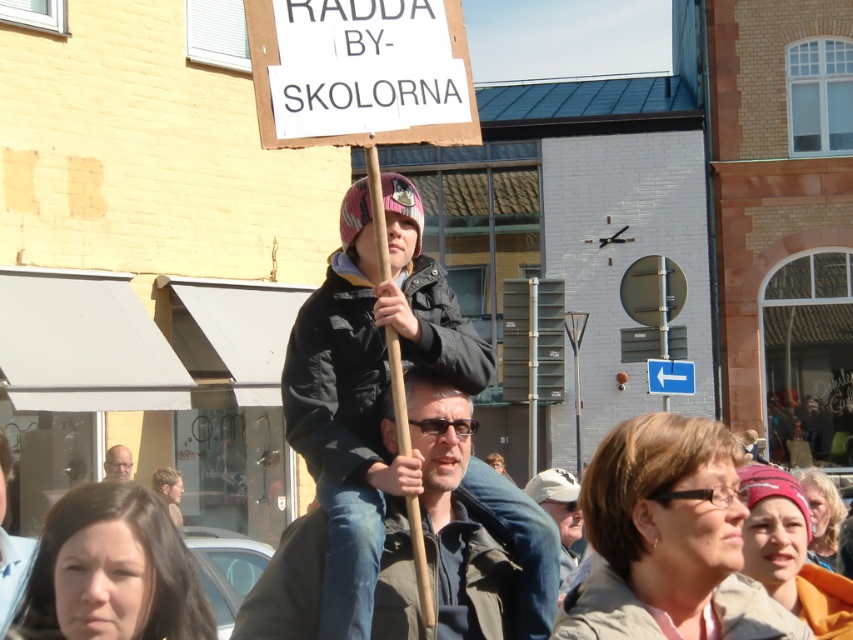
Question: Is dark green jacket at center above matte black glasses at lower left?

Choices:
 (A) yes
 (B) no

Answer: (A)

Question: Which object is closer to the camera taking this photo?

Choices:
 (A) light brown leather jacket at lower left
 (B) matte black glasses at lower left
 (C) dark green jacket at center

Answer: (A)

Question: Which point appears farthest from the camera in this image?

Choices:
 (A) (3, 625)
 (B) (440, 404)
 (C) (117, 465)

Answer: (C)

Question: Is dark green jacket at center to the left of light brown leather jacket at lower left from the viewer's perspective?

Choices:
 (A) yes
 (B) no

Answer: (B)

Question: Is the position of dark green jacket at center less distant than that of light brown leather jacket at lower left?

Choices:
 (A) no
 (B) yes

Answer: (A)

Question: Among these points, which one is farthest from the camera?

Choices:
 (A) (308, 627)
 (B) (115, 452)

Answer: (B)